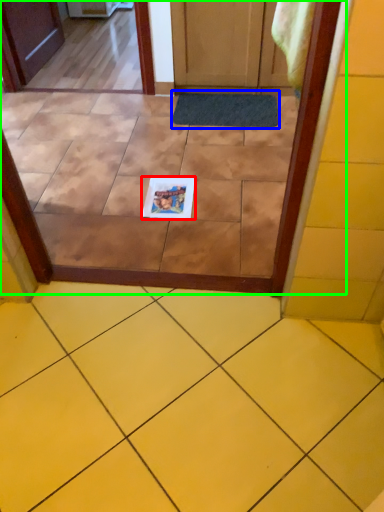
Question: Considering the real-world distances, which object is closest to copy (highlighted by a red box)? doormat (highlighted by a blue box) or glass door (highlighted by a green box).

Choices:
 (A) doormat
 (B) glass door

Answer: (B)